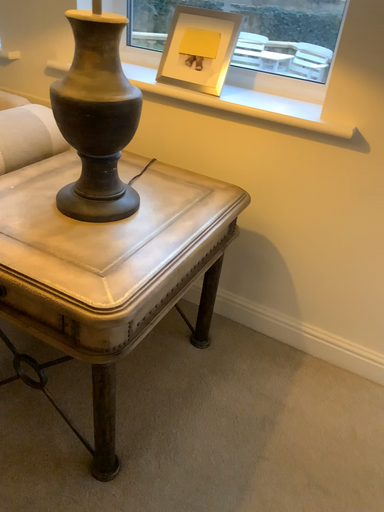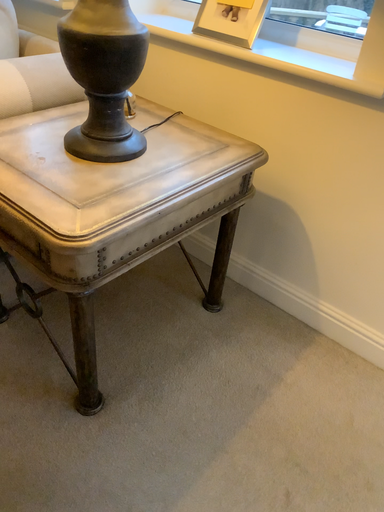
Question: How did the camera likely rotate when shooting the video?

Choices:
 (A) rotated right
 (B) rotated left

Answer: (B)